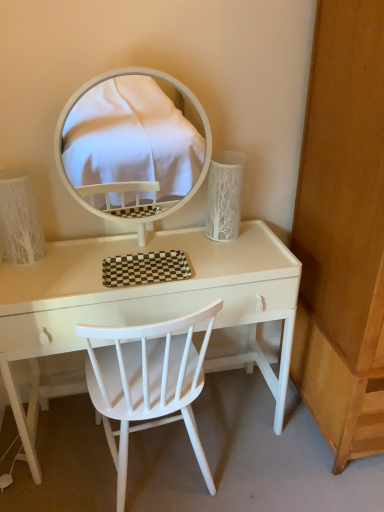
Question: Can you confirm if white glossy table at center is positioned to the left of white textured lampshade at left, which appears as the 2th table lamp when viewed from the right?

Choices:
 (A) yes
 (B) no

Answer: (B)

Question: Is white glossy table at center surrounding white textured lampshade at left, marked as the first table lamp in a left-to-right arrangement?

Choices:
 (A) yes
 (B) no

Answer: (B)

Question: Considering the relative positions of white glossy table at center and white textured lampshade at left, which appears as the 2th table lamp when viewed from the right, in the image provided, is white glossy table at center in front of white textured lampshade at left, which appears as the 2th table lamp when viewed from the right,?

Choices:
 (A) yes
 (B) no

Answer: (A)

Question: Can you confirm if white glossy table at center is wider than white textured lampshade at left, which appears as the 2th table lamp when viewed from the right?

Choices:
 (A) yes
 (B) no

Answer: (A)

Question: Considering the relative positions of white glossy table at center and white textured lampshade at left, marked as the first table lamp in a left-to-right arrangement, in the image provided, is white glossy table at center to the right of white textured lampshade at left, marked as the first table lamp in a left-to-right arrangement, from the viewer's perspective?

Choices:
 (A) no
 (B) yes

Answer: (B)

Question: Is white textured lampshade at left, marked as the first table lamp in a left-to-right arrangement, wider or thinner than white glossy mirror at upper center?

Choices:
 (A) thin
 (B) wide

Answer: (B)

Question: Considering the relative positions of white textured lampshade at left, marked as the first table lamp in a left-to-right arrangement, and white glossy mirror at upper center in the image provided, is white textured lampshade at left, marked as the first table lamp in a left-to-right arrangement, to the left or to the right of white glossy mirror at upper center?

Choices:
 (A) left
 (B) right

Answer: (A)

Question: From the image's perspective, is white textured lampshade at left, which appears as the 2th table lamp when viewed from the right, located above or below white glossy mirror at upper center?

Choices:
 (A) above
 (B) below

Answer: (B)

Question: From a real-world perspective, is white textured lampshade at left, which appears as the 2th table lamp when viewed from the right, above or below white glossy mirror at upper center?

Choices:
 (A) above
 (B) below

Answer: (B)

Question: Visually, is white glossy mirror at upper center positioned to the left or to the right of white textured vase at right, which is the 2th table lamp from left to right?

Choices:
 (A) left
 (B) right

Answer: (A)

Question: From the image's perspective, relative to white textured vase at right, which is the 2th table lamp from left to right, is white glossy mirror at upper center above or below?

Choices:
 (A) above
 (B) below

Answer: (A)

Question: Is white glossy mirror at upper center in front of or behind white textured vase at right, which is the 2th table lamp from left to right, in the image?

Choices:
 (A) behind
 (B) front

Answer: (B)

Question: In terms of width, does white glossy mirror at upper center look wider or thinner when compared to white textured vase at right, which is the first table lamp from right to left?

Choices:
 (A) thin
 (B) wide

Answer: (A)

Question: Relative to white textured lampshade at left, marked as the first table lamp in a left-to-right arrangement, is white wood chair at center in front or behind?

Choices:
 (A) behind
 (B) front

Answer: (B)

Question: From their relative heights in the image, would you say white wood chair at center is taller or shorter than white textured lampshade at left, marked as the first table lamp in a left-to-right arrangement?

Choices:
 (A) tall
 (B) short

Answer: (A)